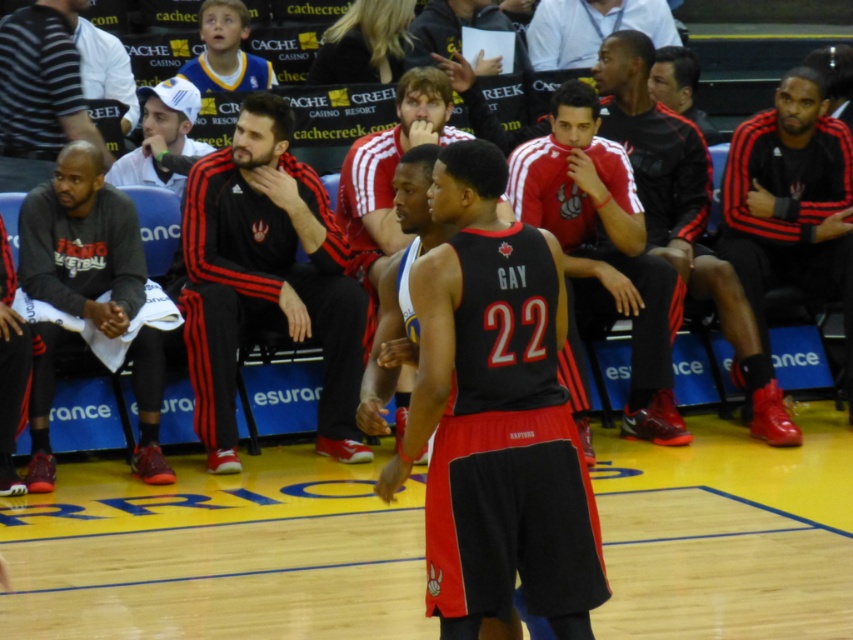
Question: Estimate the real-world distances between objects in this image. Which object is closer to the red matte jersey at center?

Choices:
 (A) dark gray jersey at left
 (B) white shirt at upper center
 (C) white matte cap at upper center

Answer: (B)

Question: Is black jersey at center smaller than red matte jersey at center?

Choices:
 (A) no
 (B) yes

Answer: (B)

Question: Which of the following is the farthest from the observer?

Choices:
 (A) black leather jacket at center
 (B) dark gray striped shirt at left
 (C) red matte jersey at center
 (D) white shirt at upper center

Answer: (D)

Question: Which object is farther from the camera taking this photo?

Choices:
 (A) red matte jersey at center
 (B) black leather jacket at center

Answer: (B)

Question: Can you confirm if black adidas tracksuit at center is positioned above white matte cap at upper center?

Choices:
 (A) yes
 (B) no

Answer: (B)

Question: Can you confirm if dark gray jersey at left is positioned to the left of black leather jacket at center?

Choices:
 (A) yes
 (B) no

Answer: (A)